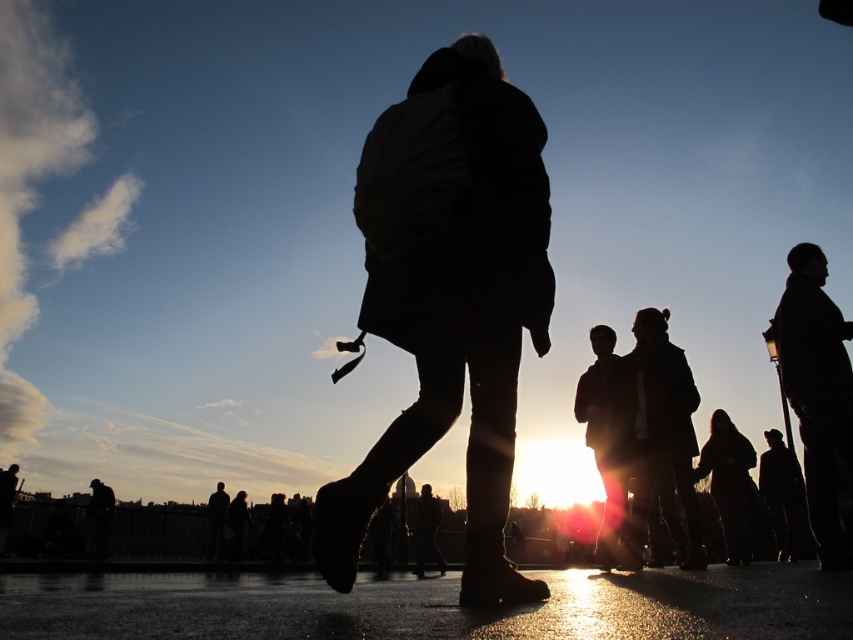
Consider the image. You are a photographer trying to capture a group photo of the black matte coat at center and the black matte jacket at upper right. The camera you are using has a maximum focus range of 4 meters. Can you fit both subjects into the frame without moving closer?

The distance between the black matte coat at center and the black matte jacket at upper right is 4.41 meters, which exceeds the camera maximum focus range of 4 meters. Therefore, you cannot fit both subjects into the frame without moving closer.

You are a fashion designer observing the sunset scene. You need to determine which clothing item is shorter between the black matte coat at center and the black matte jacket at upper right. Which one should you choose?

The black matte coat at center is shorter than the black matte jacket at upper right, so you should choose the black matte coat at center if you need a shorter item.